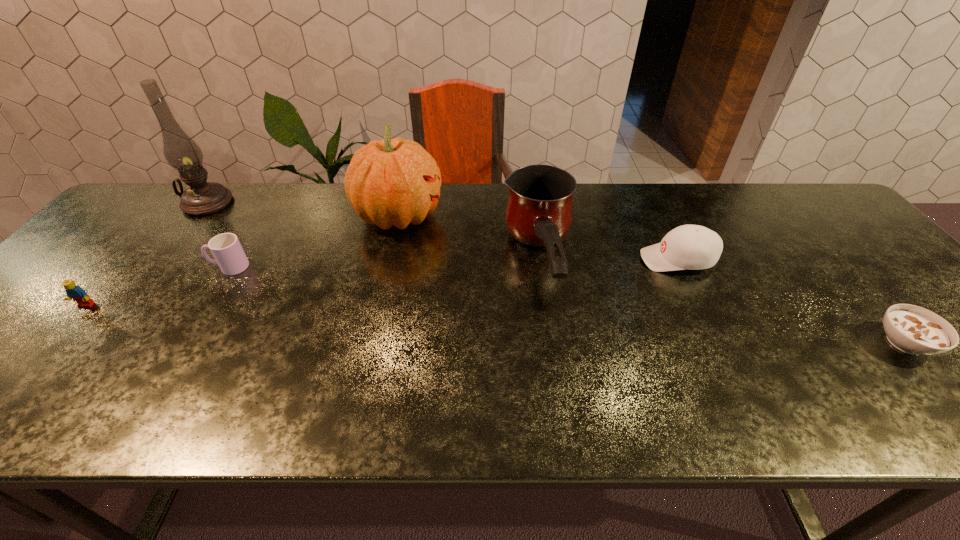
Find the location of a particular element. The image size is (960, 540). oil lamp is located at coordinates (182, 153).

Image resolution: width=960 pixels, height=540 pixels. In order to click on the fourth object from left to right in this screenshot , I will do `click(390, 182)`.

Identify the location of the second tallest object. The image size is (960, 540). (390, 182).

I want to click on the third tallest object, so click(539, 211).

At what (x,y) coordinates should I click in order to perform the action: click on saucepan. Please return your answer as a coordinate pair (x, y). The image size is (960, 540). Looking at the image, I should click on (539, 211).

Locate an element on the screen. baseball cap is located at coordinates (694, 247).

At what (x,y) coordinates should I click in order to perform the action: click on cup. Please return your answer as a coordinate pair (x, y). Image resolution: width=960 pixels, height=540 pixels. Looking at the image, I should click on (229, 255).

Image resolution: width=960 pixels, height=540 pixels. Identify the location of Lego. (73, 291).

Locate an element on the screen. This screenshot has height=540, width=960. the shortest object is located at coordinates (912, 329).

This screenshot has width=960, height=540. Find the location of `the rightmost object`. the rightmost object is located at coordinates (912, 329).